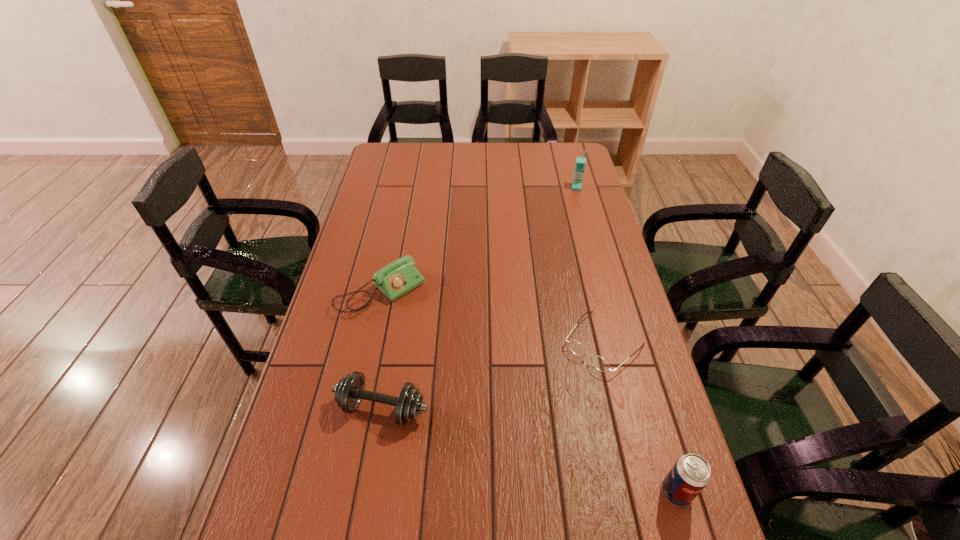
Image resolution: width=960 pixels, height=540 pixels. What are the coordinates of `free space on the desktop that is between the third tallest object and the fourth shortest object and is positioned on the dial of the telephone` in the screenshot? It's located at (550, 456).

Where is `free spot on the desktop that is between the dumbbell and the second tallest object and is positioned through the lenses of the shortest object`? The image size is (960, 540). free spot on the desktop that is between the dumbbell and the second tallest object and is positioned through the lenses of the shortest object is located at coordinates (512, 445).

Identify the location of free space on the desktop that is between the third tallest object and the second tallest object and is positioned on the keypad of the tallest object. Image resolution: width=960 pixels, height=540 pixels. (547, 455).